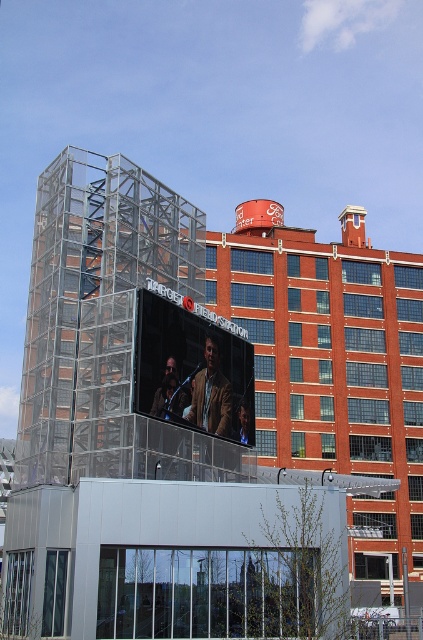
Question: Which object appears closest to the camera in this image?

Choices:
 (A) leather jacket at center
 (B) matte brown jacket at center

Answer: (A)

Question: In this image, where is leather jacket at center located relative to shiny black jacket at center?

Choices:
 (A) below
 (B) above

Answer: (B)

Question: Which is nearer to the matte brown jacket at center?

Choices:
 (A) leather jacket at center
 (B) shiny black jacket at center

Answer: (A)

Question: From the image, what is the correct spatial relationship of shiny black jacket at center in relation to matte brown jacket at center?

Choices:
 (A) right
 (B) left

Answer: (B)

Question: Can you confirm if shiny black jacket at center is smaller than matte brown jacket at center?

Choices:
 (A) yes
 (B) no

Answer: (B)

Question: Which object is the closest to the leather jacket at center?

Choices:
 (A) matte brown jacket at center
 (B) shiny black jacket at center

Answer: (B)